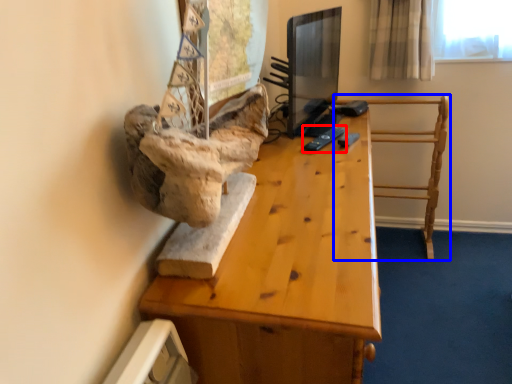
Question: Among these objects, which one is nearest to the camera, remote (highlighted by a red box) or furniture (highlighted by a blue box)?

Choices:
 (A) remote
 (B) furniture

Answer: (A)